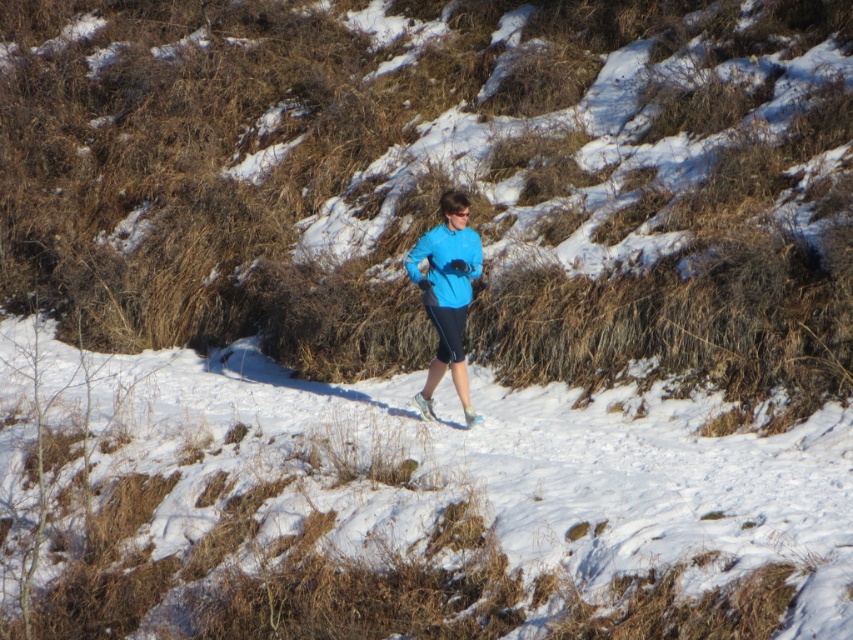
You are a hiker who needs to cross the white powdery snow at center while avoiding the blue matte jacket at center. Can you safely walk through the snow without getting too close to the jacket?

The distance between the white powdery snow at center and blue matte jacket at center is 7.13 feet, which is a safe distance to walk through the snow without getting too close to the jacket.

You are planning to take a photo of the blue matte sweatshirt at center and the white powdery snow at center. Since you want both objects to be clearly visible in the frame, which object should you focus on to ensure proper depth of field?

You should focus on the blue matte sweatshirt at center because it is narrower than the white powdery snow at center, so focusing on the narrower object will ensure both are in focus.